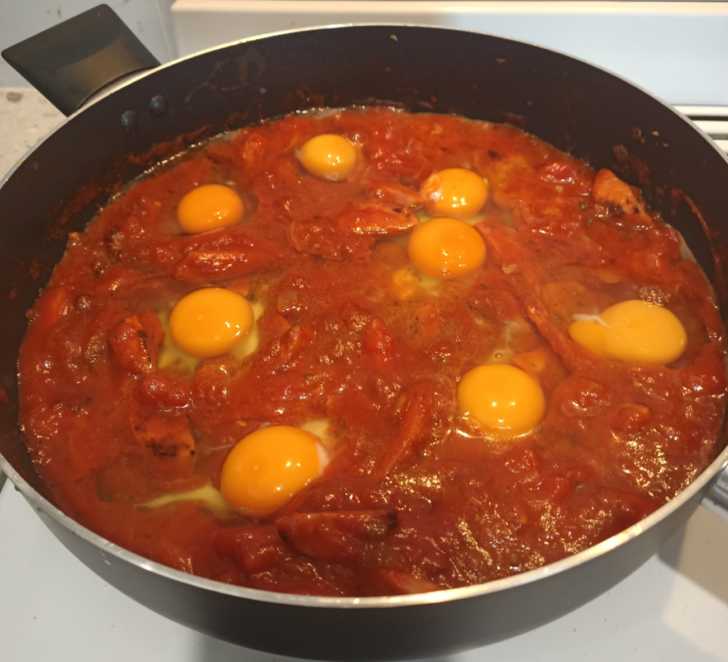
This screenshot has width=728, height=662. Find the location of `metalic rim of cooking pan`. metalic rim of cooking pan is located at coordinates (451, 594).